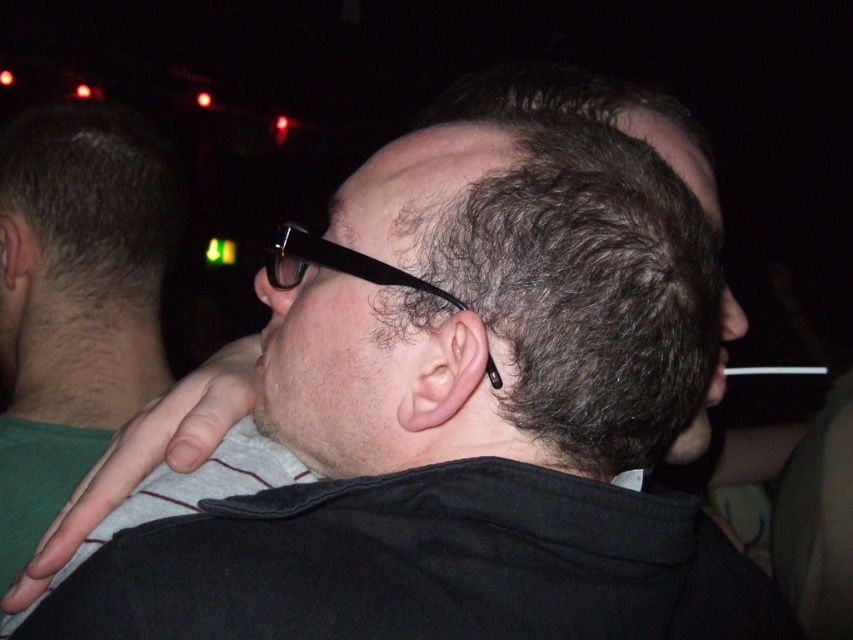
Describe the element at coordinates (77, 301) in the screenshot. Image resolution: width=853 pixels, height=640 pixels. I see `dark matte hair at center` at that location.

In the scene shown: Is dark matte hair at center shorter than matte black ear at center?

No.

Image resolution: width=853 pixels, height=640 pixels. Describe the element at coordinates (77, 301) in the screenshot. I see `dark matte hair at center` at that location.

The height and width of the screenshot is (640, 853). Identify the location of dark matte hair at center. (77, 301).

Can you confirm if black plastic glasses at center is positioned above matte black ear at center?

No.

Describe the element at coordinates (334, 262) in the screenshot. I see `black plastic glasses at center` at that location.

You are a GUI agent. You are given a task and a screenshot of the screen. Output one action in this format:
    pyautogui.click(x=<x>, y=<y>)
    Task: Click on the black plastic glasses at center
    Image resolution: width=853 pixels, height=640 pixels.
    Given the screenshot: What is the action you would take?
    pyautogui.click(x=334, y=262)

This screenshot has height=640, width=853. Describe the element at coordinates (77, 301) in the screenshot. I see `dark matte hair at center` at that location.

Does dark matte hair at center appear over skinny ear at center?

Yes.

This screenshot has height=640, width=853. I want to click on dark matte hair at center, so click(x=77, y=301).

In order to click on dark matte hair at center in this screenshot , I will do `click(77, 301)`.